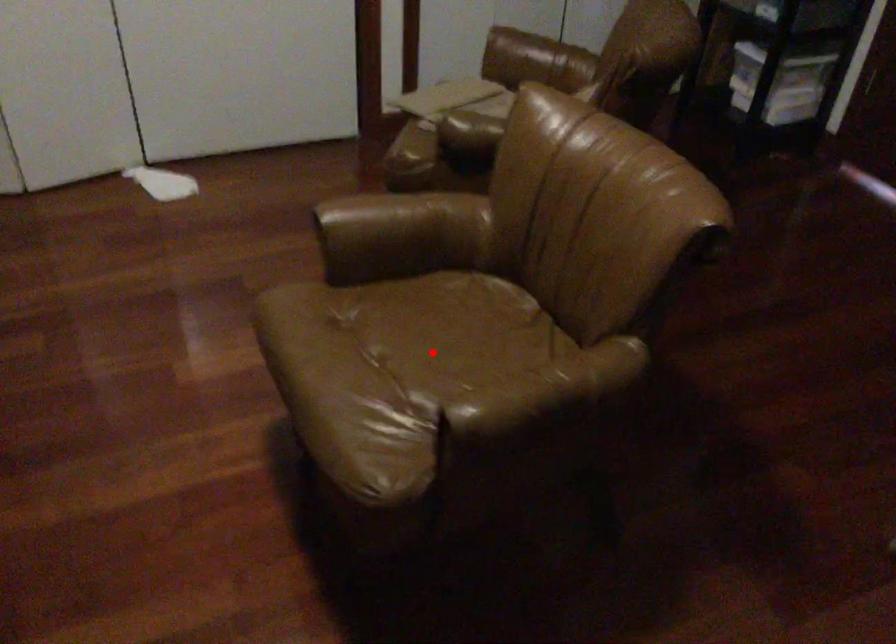
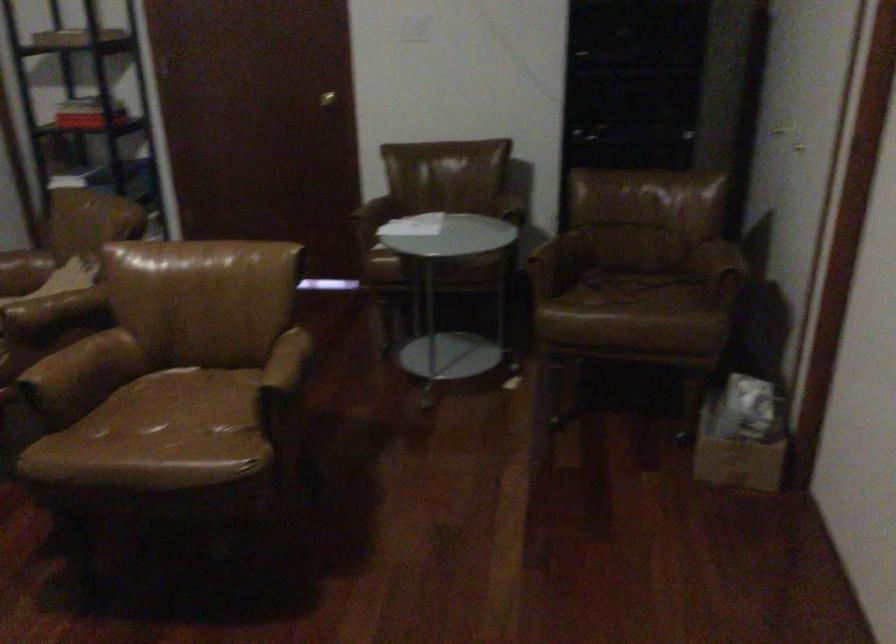
Question: I am providing you with two images of the same scene from different viewpoints. In image1, a red point is highlighted. Considering the same 3D point in image2, which of the following is correct?

Choices:
 (A) It is closer
 (B) It is farther

Answer: (B)